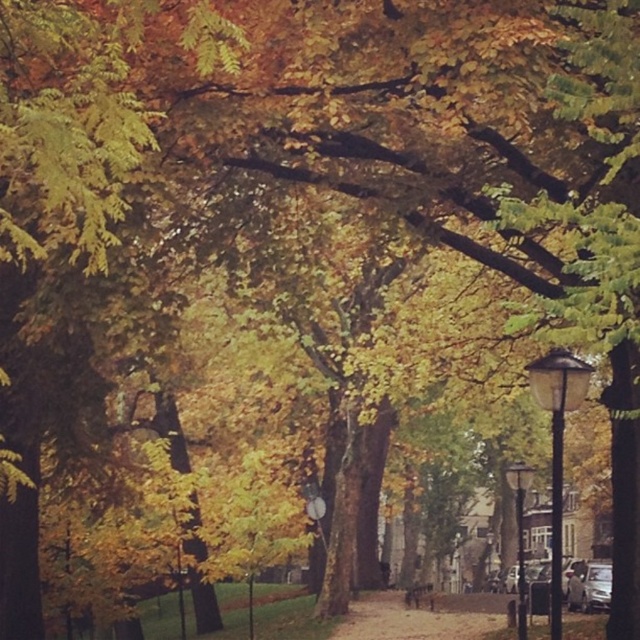
Question: In this image, where is matte black lamp post at center right located relative to matte black lamp post at right?

Choices:
 (A) above
 (B) below

Answer: (A)

Question: Which object appears closest to the camera in this image?

Choices:
 (A) matte black lamp post at right
 (B) matte black lamp post at center right

Answer: (B)

Question: Is matte black lamp post at center right bigger than matte black lamp post at right?

Choices:
 (A) no
 (B) yes

Answer: (A)

Question: Does matte black lamp post at center right have a lesser width compared to matte black lamp post at right?

Choices:
 (A) no
 (B) yes

Answer: (B)

Question: Which point is farther from the camera taking this photo?

Choices:
 (A) pyautogui.click(x=516, y=600)
 (B) pyautogui.click(x=554, y=518)

Answer: (A)